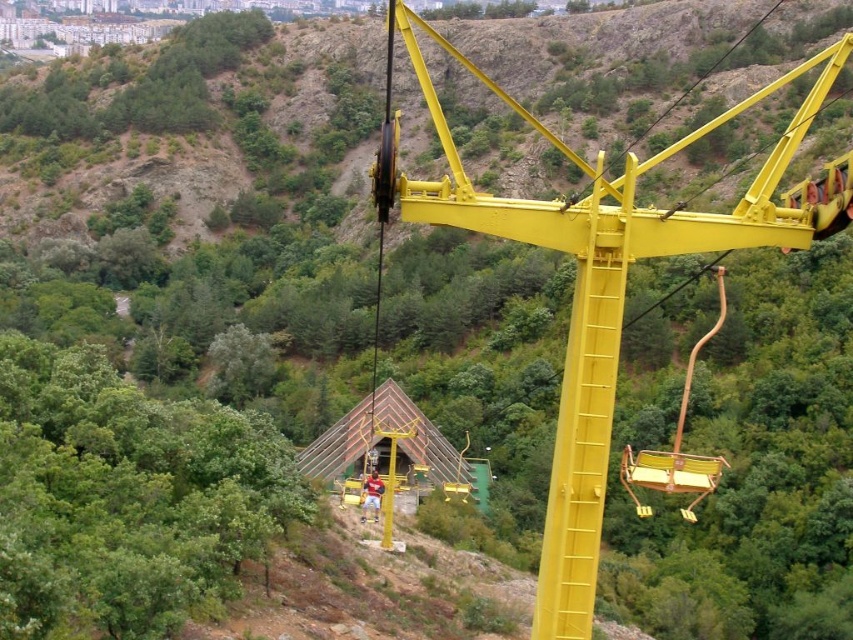
Question: Is yellow metallic crane at center smaller than metallic yellow swing at right?

Choices:
 (A) no
 (B) yes

Answer: (A)

Question: Does yellow metallic crane at center appear over metallic yellow swing at right?

Choices:
 (A) no
 (B) yes

Answer: (B)

Question: Is the position of yellow metallic crane at center less distant than that of metallic yellow swing at right?

Choices:
 (A) yes
 (B) no

Answer: (A)

Question: Which object is closer to the camera taking this photo?

Choices:
 (A) metallic yellow swing at right
 (B) transparent plastic hut at center

Answer: (A)

Question: Which point appears farthest from the camera in this image?

Choices:
 (A) (376, 184)
 (B) (647, 451)
 (C) (332, 472)

Answer: (C)

Question: Which object is farther from the camera taking this photo?

Choices:
 (A) metallic yellow swing at right
 (B) yellow metallic crane at center
 (C) transparent plastic hut at center

Answer: (C)